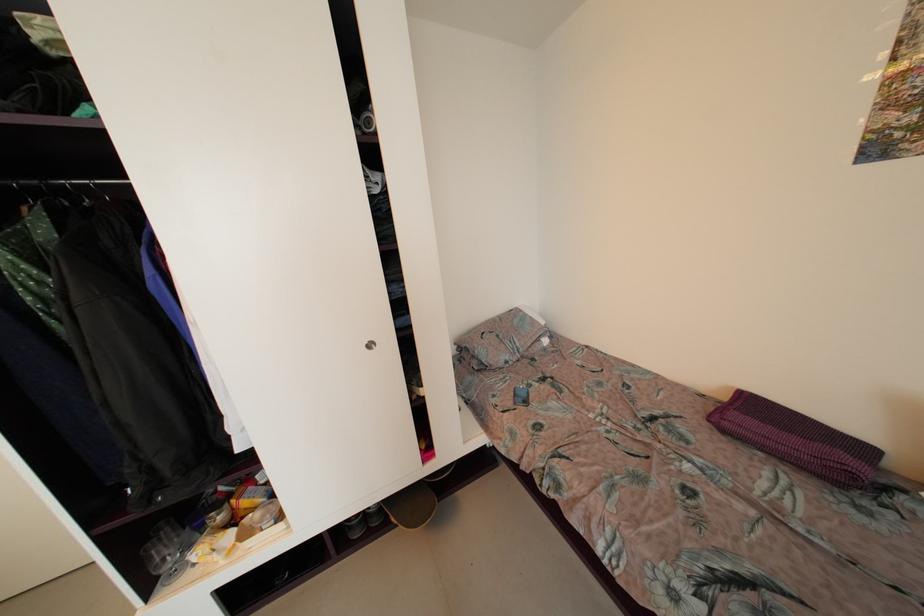
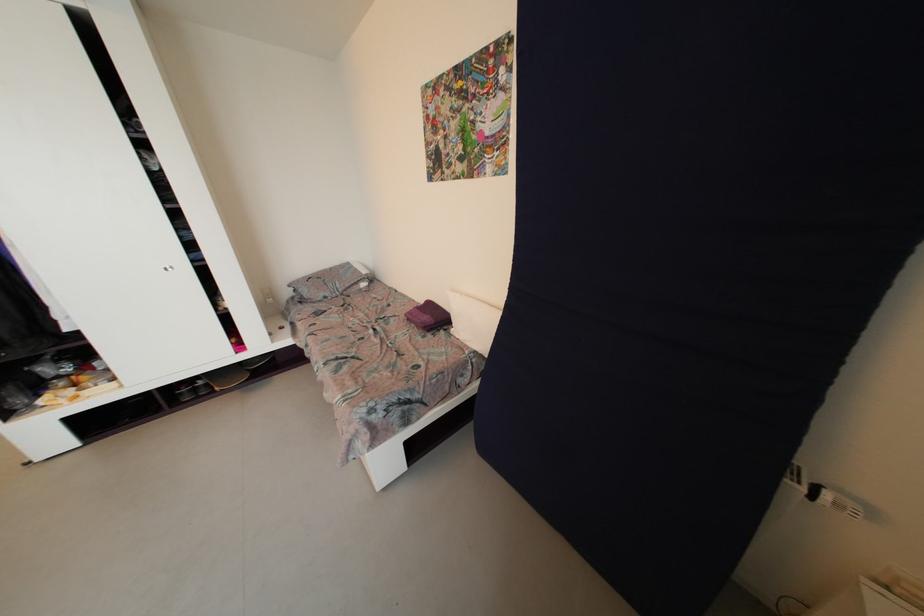
In the second image, find the point that corresponds to (x=460, y=346) in the first image.

(294, 288)